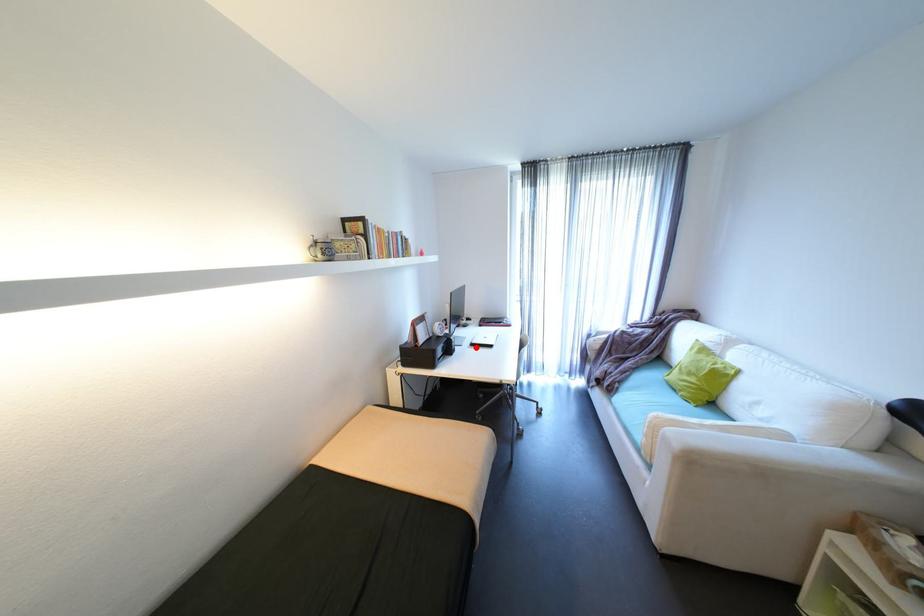
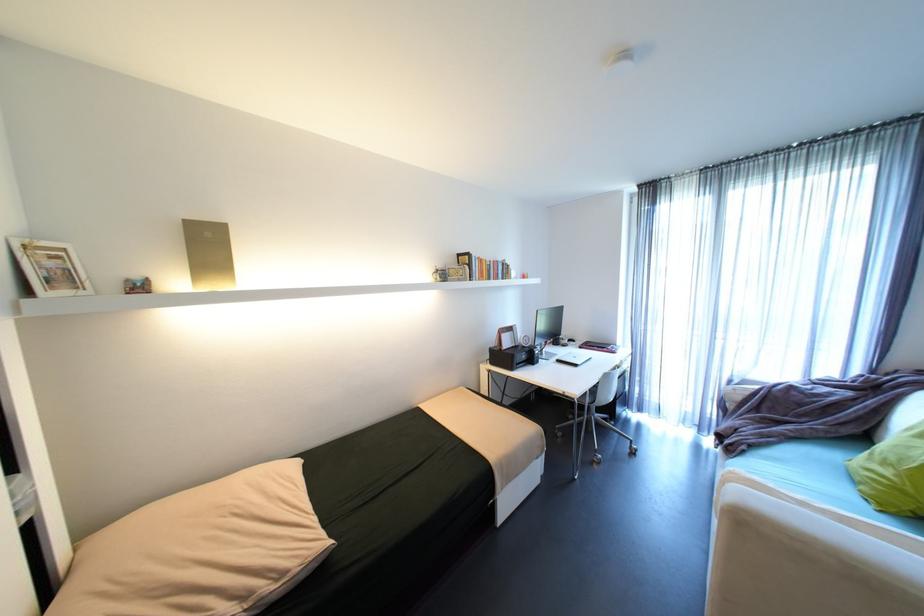
Question: I am providing you with two images of the same scene from different viewpoints. Given a red point in image1, look at the same physical point in image2. Is it:

Choices:
 (A) Closer to the viewpoint
 (B) Farther from the viewpoint

Answer: (B)